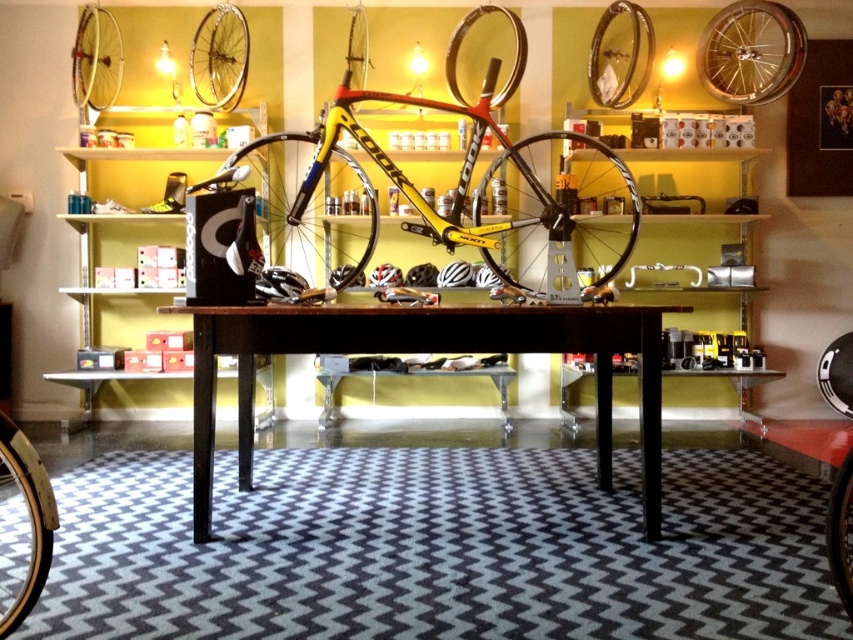
Between point (364, 64) and point (837, 589), which one is positioned behind?

Positioned behind is point (364, 64).

Which is above, yellow matte bicycle at center or black rubber tire at center?

Positioned higher is yellow matte bicycle at center.

What do you see at coordinates (451, 188) in the screenshot? The height and width of the screenshot is (640, 853). I see `yellow matte bicycle at center` at bounding box center [451, 188].

What are the coordinates of `yellow matte bicycle at center` in the screenshot? It's located at tap(451, 188).

Between shiny silver rim at lower left and black rubber tire at center, which one has less height?

Standing shorter between the two is shiny silver rim at lower left.

What do you see at coordinates (22, 525) in the screenshot? I see `shiny silver rim at lower left` at bounding box center [22, 525].

At what (x,y) coordinates should I click in order to perform the action: click on shiny silver rim at lower left. Please return your answer as a coordinate pair (x, y). The height and width of the screenshot is (640, 853). Looking at the image, I should click on (22, 525).

Based on the photo, who is positioned more to the right, yellow matte bicycle at center or shiny gold rim at upper left?

From the viewer's perspective, yellow matte bicycle at center appears more on the right side.

Which is below, yellow matte bicycle at center or shiny gold rim at upper left?

yellow matte bicycle at center

Locate an element on the screen. yellow matte bicycle at center is located at coordinates (451, 188).